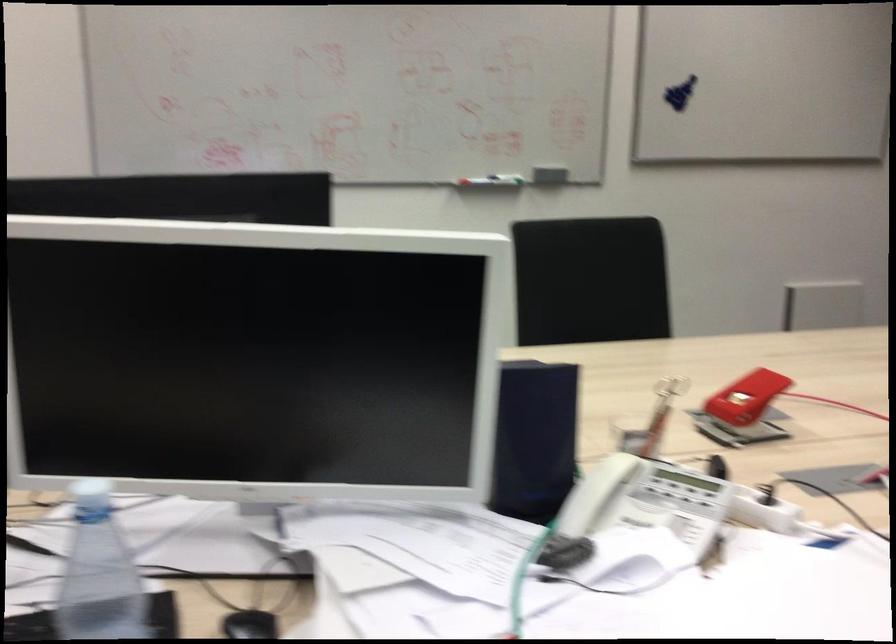
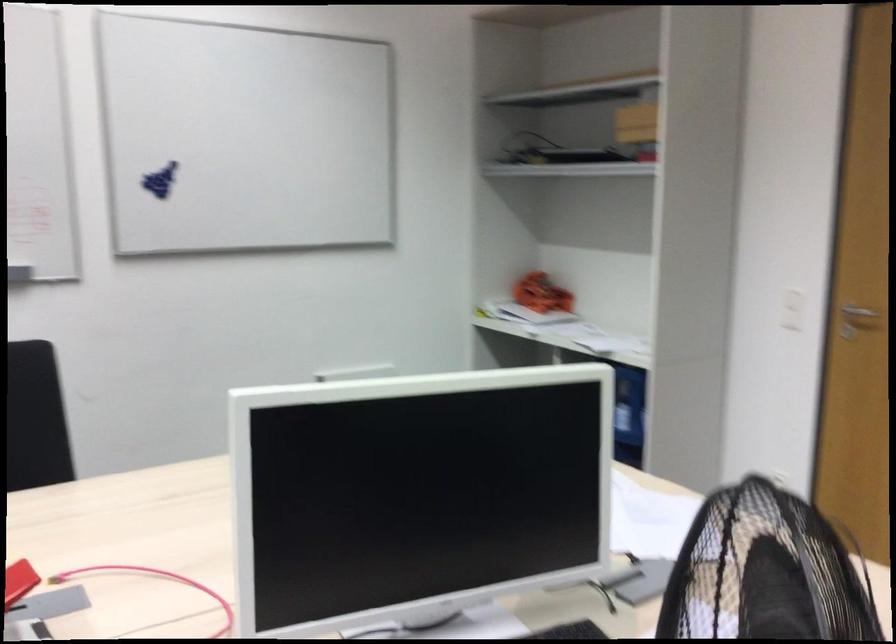
Question: The images are taken continuously from a first-person perspective. In which direction is your viewpoint rotating?

Choices:
 (A) Left
 (B) Right
 (C) Up
 (D) Down

Answer: (B)